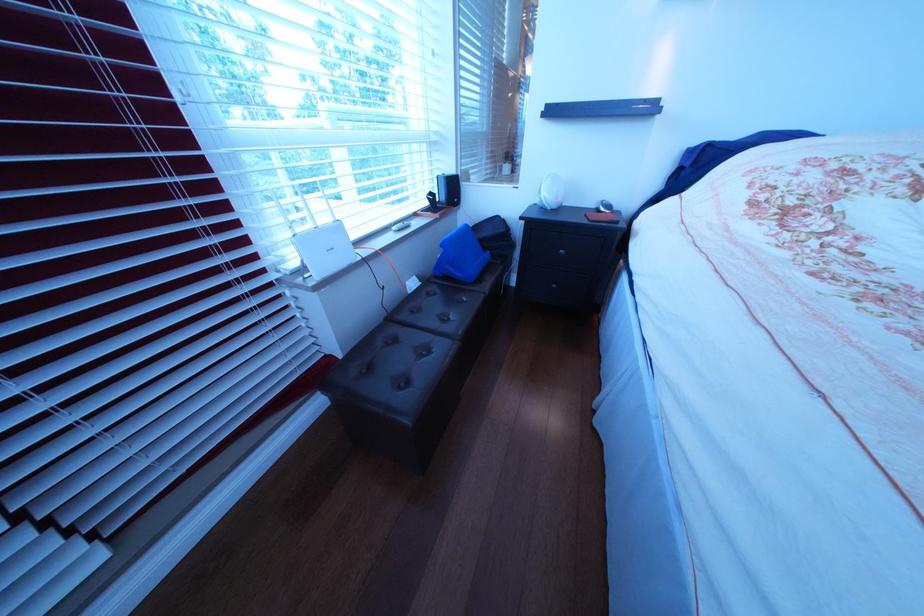
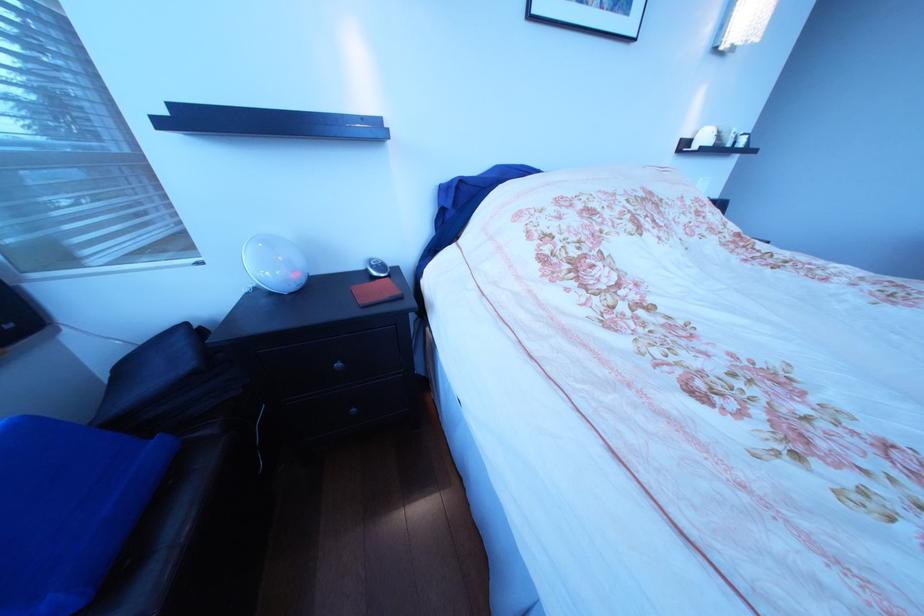
The point at [503,257] is marked in the first image. Where is the corresponding point in the second image?

(172, 450)